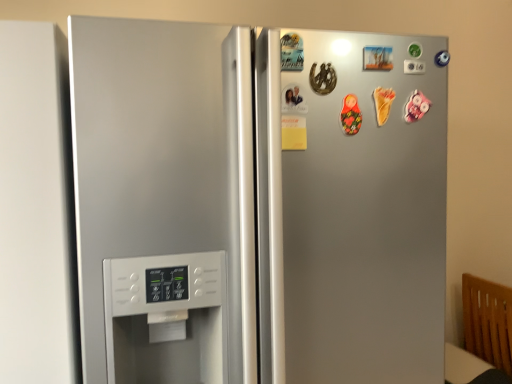
Question: Considering the relative sizes of white matte refrigerator door at left and satin silver refrigerator at center in the image provided, is white matte refrigerator door at left thinner than satin silver refrigerator at center?

Choices:
 (A) no
 (B) yes

Answer: (B)

Question: Is white matte refrigerator door at left positioned behind satin silver refrigerator at center?

Choices:
 (A) yes
 (B) no

Answer: (A)

Question: Can you confirm if white matte refrigerator door at left is positioned to the right of satin silver refrigerator at center?

Choices:
 (A) no
 (B) yes

Answer: (A)

Question: Could you tell me if white matte refrigerator door at left is turned towards satin silver refrigerator at center?

Choices:
 (A) no
 (B) yes

Answer: (A)

Question: From a real-world perspective, is white matte refrigerator door at left physically below satin silver refrigerator at center?

Choices:
 (A) no
 (B) yes

Answer: (A)

Question: Can we say white matte refrigerator door at left lies outside satin silver refrigerator at center?

Choices:
 (A) no
 (B) yes

Answer: (B)

Question: From the image's perspective, is satin silver refrigerator at center over white matte refrigerator door at left?

Choices:
 (A) yes
 (B) no

Answer: (B)

Question: Is satin silver refrigerator at center to the right of white matte refrigerator door at left from the viewer's perspective?

Choices:
 (A) no
 (B) yes

Answer: (B)

Question: From the image's perspective, is satin silver refrigerator at center located beneath white matte refrigerator door at left?

Choices:
 (A) yes
 (B) no

Answer: (A)

Question: Are satin silver refrigerator at center and white matte refrigerator door at left located far from each other?

Choices:
 (A) no
 (B) yes

Answer: (A)

Question: Can you confirm if satin silver refrigerator at center is taller than white matte refrigerator door at left?

Choices:
 (A) yes
 (B) no

Answer: (A)

Question: From a real-world perspective, is satin silver refrigerator at center located beneath white matte refrigerator door at left?

Choices:
 (A) yes
 (B) no

Answer: (A)

Question: In terms of size, does white matte refrigerator door at left appear bigger or smaller than satin silver refrigerator at center?

Choices:
 (A) small
 (B) big

Answer: (A)